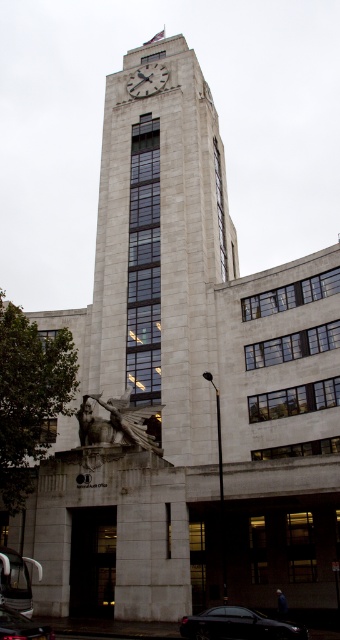
Question: Which object appears farthest from the camera in this image?

Choices:
 (A) shiny black car at lower left
 (B) shiny black car at lower center

Answer: (B)

Question: Does bronze statue at lower left have a greater width compared to white stone clock at upper center?

Choices:
 (A) no
 (B) yes

Answer: (B)

Question: Which object is farther from the camera taking this photo?

Choices:
 (A) bronze statue at lower left
 (B) shiny black car at lower center

Answer: (A)

Question: Which point is closer to the camera taking this photo?

Choices:
 (A) 185,634
 (B) 25,634
 (C) 141,76

Answer: (B)

Question: From the image, what is the correct spatial relationship of shiny black car at lower center in relation to white stone clock at upper center?

Choices:
 (A) right
 (B) left

Answer: (A)

Question: Can you confirm if shiny black car at lower left is positioned above white stone clock at upper center?

Choices:
 (A) yes
 (B) no

Answer: (B)